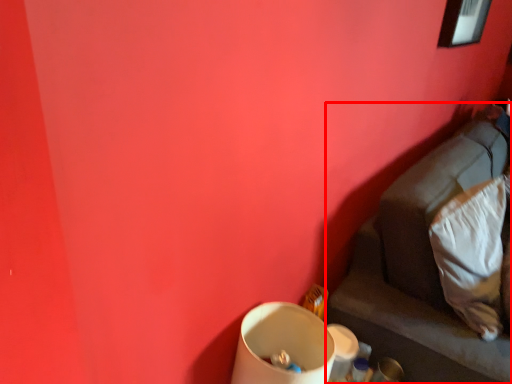
Question: From the image's perspective, where is furniture (annotated by the red box) located in relation to pillow in the image?

Choices:
 (A) above
 (B) below

Answer: (B)